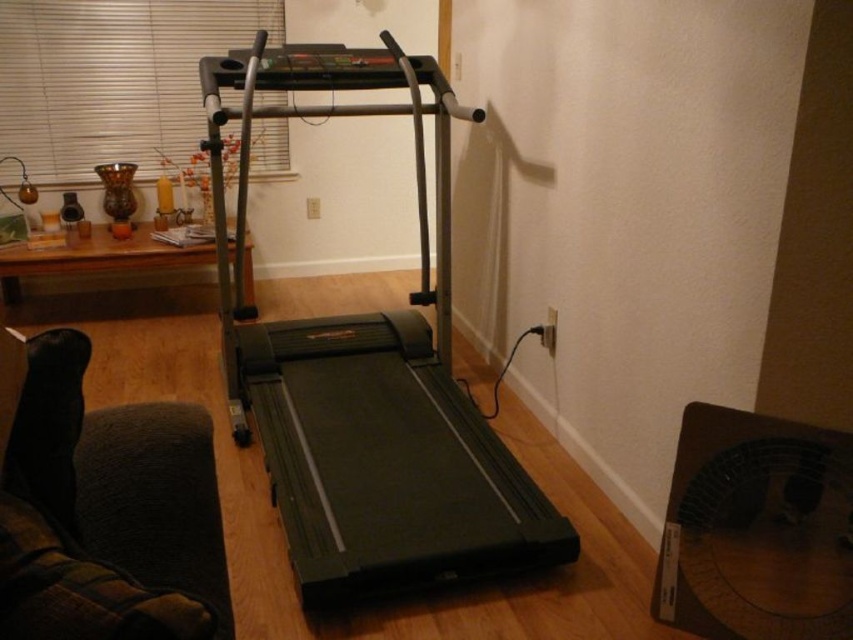
Question: Which of the following is the farthest from the observer?

Choices:
 (A) (256, 12)
 (B) (270, 433)

Answer: (A)

Question: Estimate the real-world distances between objects in this image. Which object is closer to the black plastic fan at lower right?

Choices:
 (A) white textured blind at upper left
 (B) black rubber treadmill at center

Answer: (B)

Question: Among these objects, which one is farthest from the camera?

Choices:
 (A) white textured blind at upper left
 (B) brown wood table at left

Answer: (A)

Question: Is the position of black plastic fan at lower right less distant than that of brown wood table at left?

Choices:
 (A) yes
 (B) no

Answer: (A)

Question: Does white textured blind at upper left come behind brown wood table at left?

Choices:
 (A) no
 (B) yes

Answer: (B)

Question: Does black rubber treadmill at center appear over black plastic fan at lower right?

Choices:
 (A) no
 (B) yes

Answer: (B)